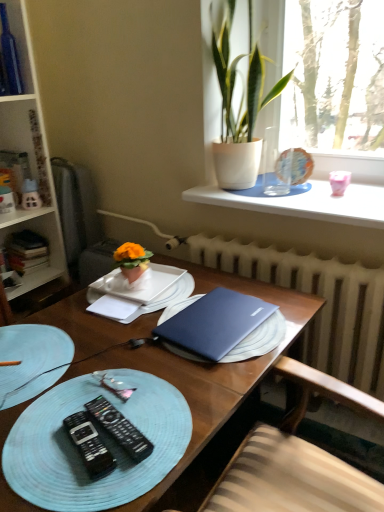
Identify the location of empty space that is ontop of satin blue laptop at center (from a real-world perspective). This screenshot has height=512, width=384. (218, 319).